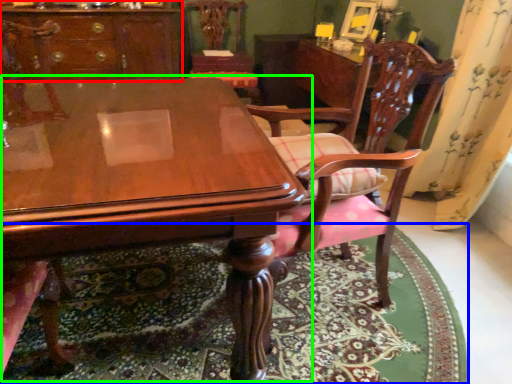
Question: Considering the real-world distances, which object is farthest from cabinetry (highlighted by a red box)? mat (highlighted by a blue box) or table (highlighted by a green box)?

Choices:
 (A) mat
 (B) table

Answer: (A)